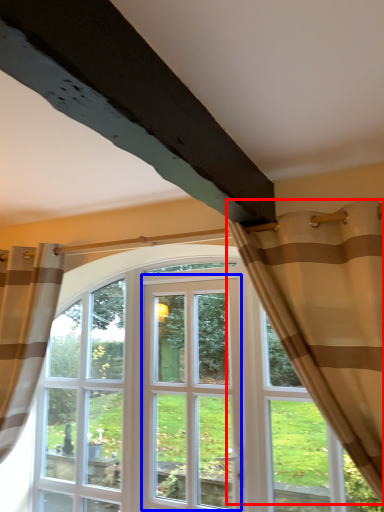
Question: Among these objects, which one is farthest to the camera, curtain (highlighted by a red box) or screen door (highlighted by a blue box)?

Choices:
 (A) curtain
 (B) screen door

Answer: (B)